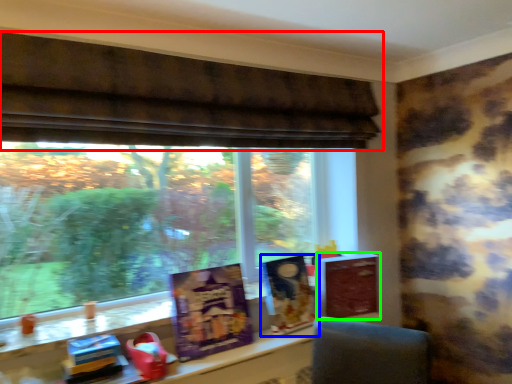
Question: Considering the real-world distances, which object is farthest from window (highlighted by a red box)? book cover (highlighted by a blue box) or paperback book (highlighted by a green box)?

Choices:
 (A) book cover
 (B) paperback book

Answer: (B)